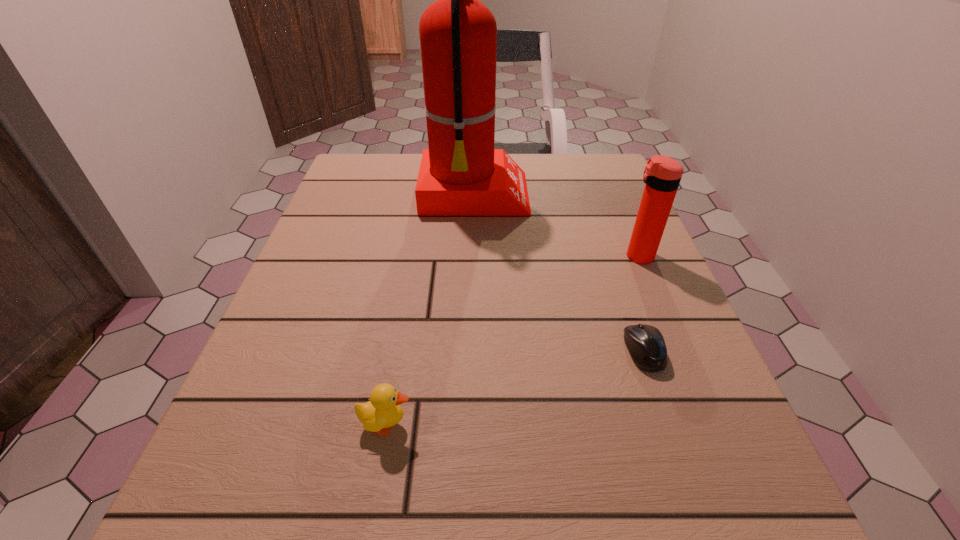
What are the coordinates of `the tallest object` in the screenshot? It's located at coord(461,174).

In order to click on fire extinguisher in this screenshot , I will do `click(461, 174)`.

Where is `the third shortest object`? the third shortest object is located at coordinates (662, 175).

Locate an element on the screen. the second farthest object is located at coordinates (662, 175).

The image size is (960, 540). In order to click on the third tallest object in this screenshot , I will do `click(383, 410)`.

Where is `the nearest object`? the nearest object is located at coordinates (383, 410).

Locate an element on the screen. the shortest object is located at coordinates [x=646, y=345].

This screenshot has width=960, height=540. Identify the location of the second nearest object. (646, 345).

Where is `vacant space located 0.250m on the front-facing side of the fire extinguisher`? Image resolution: width=960 pixels, height=540 pixels. vacant space located 0.250m on the front-facing side of the fire extinguisher is located at coordinates (630, 196).

I want to click on vacant space situated 0.170m on the back of the third nearest object, so click(616, 204).